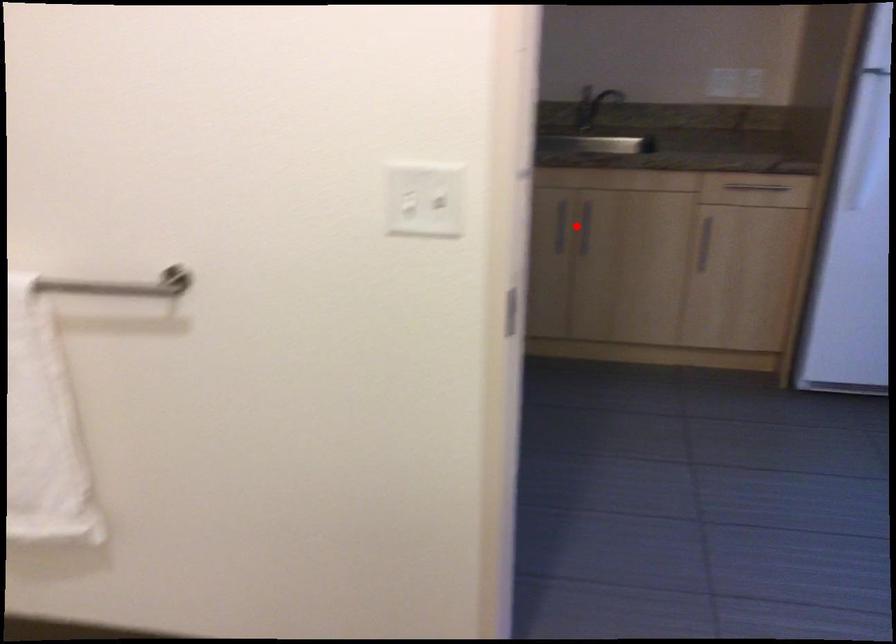
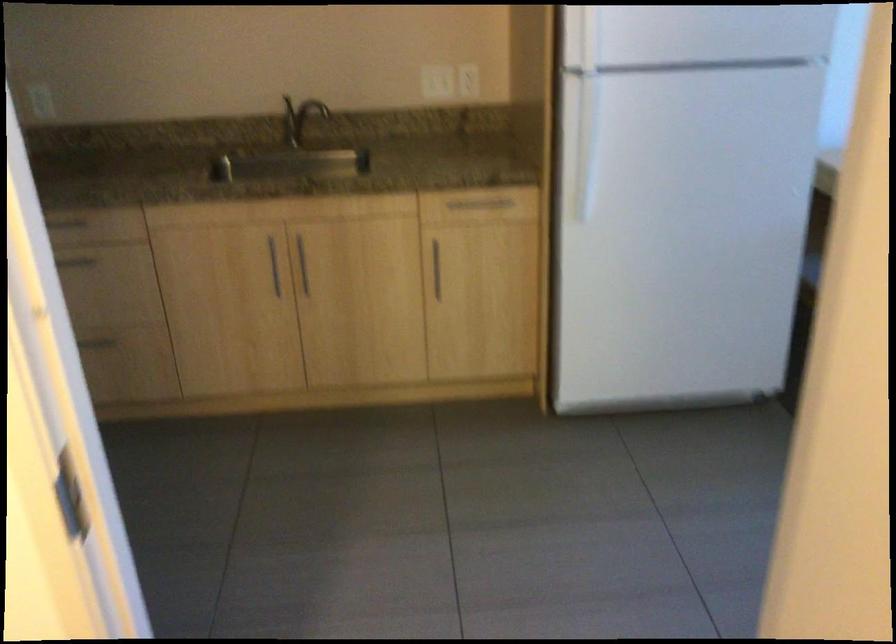
The point at the highlighted location is marked in the first image. Where is the corresponding point in the second image?

(303, 265)